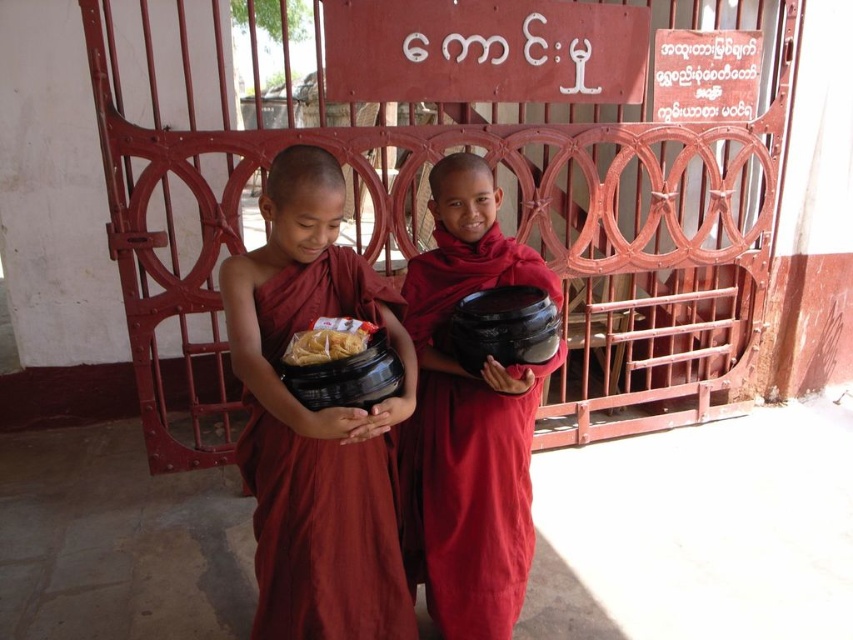
You are a delivery person who needs to place a 24 inch long package between the matte black bowl at center and the yellowish matte noodles at center. Can you fit the package in the space between them?

The distance between the matte black bowl at center and the yellowish matte noodles at center is 23.48 inches, which is shorter than the 24 inch package. Therefore, the package cannot fit between them.

You are a photographer standing in front of the red metal gate with the Burmese signboard. You notice a point at coordinate (316, 420) on your camera screen. What object is located at this point?

The point at coordinate (316, 420) corresponds to the matte red robe at center.